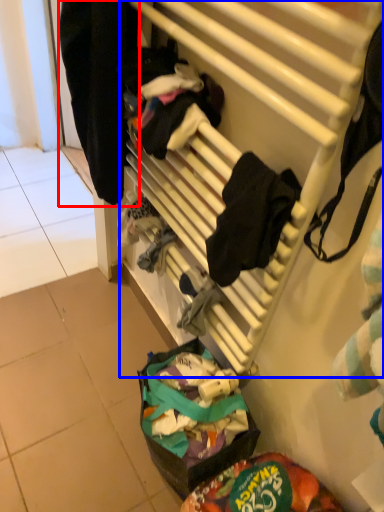
Question: Which point is closer to the camera, clothing (highlighted by a red box) or furniture (highlighted by a blue box)?

Choices:
 (A) clothing
 (B) furniture

Answer: (B)